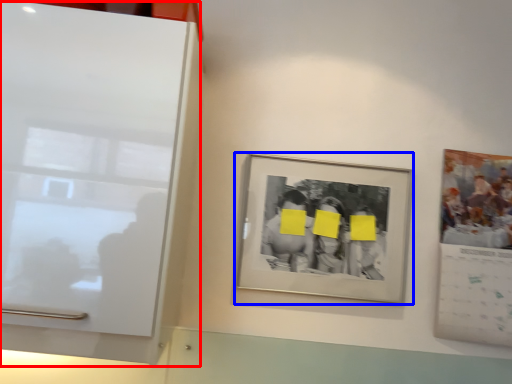
Question: Which point is further to the camera, glass door (highlighted by a red box) or picture frame (highlighted by a blue box)?

Choices:
 (A) glass door
 (B) picture frame

Answer: (B)